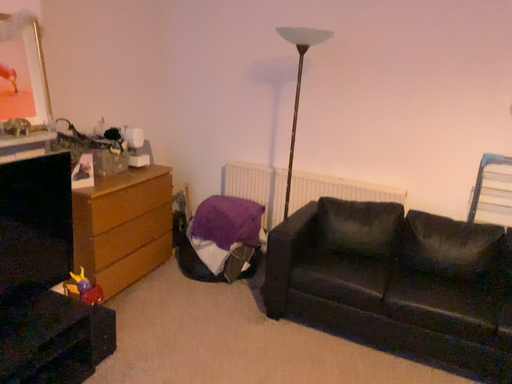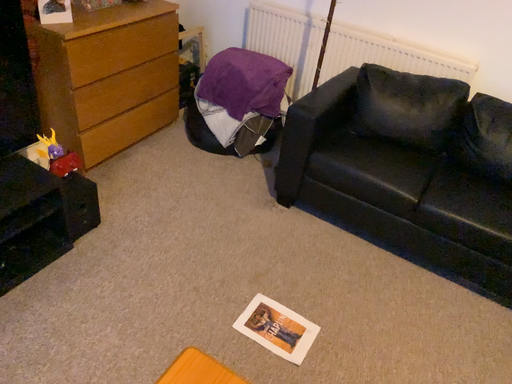
Question: How did the camera likely rotate when shooting the video?

Choices:
 (A) rotated upward
 (B) rotated downward

Answer: (B)